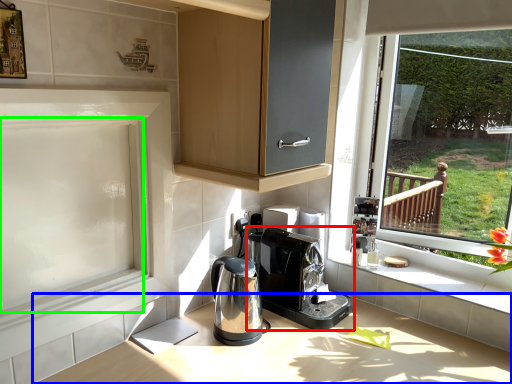
Question: Which object is positioned closest to home appliance (highlighted by a red box)? Select from countertop (highlighted by a blue box) and screen door (highlighted by a green box).

Choices:
 (A) countertop
 (B) screen door

Answer: (A)